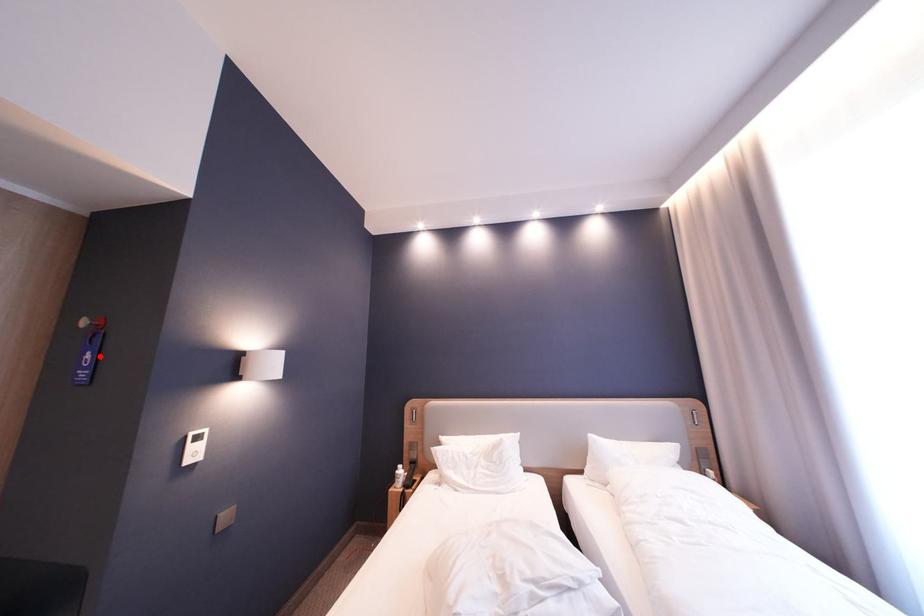
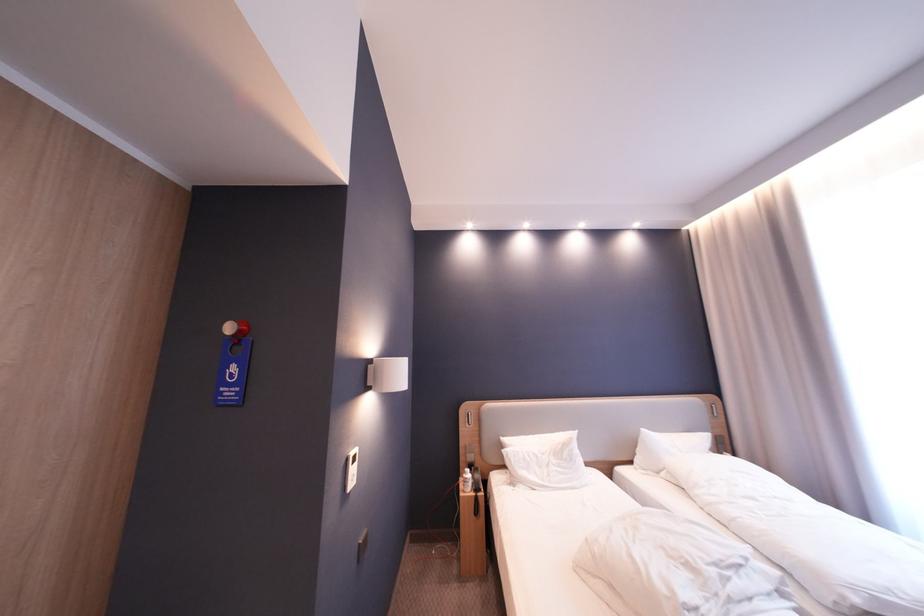
Find the pixel in the second image that matches the highlighted location in the first image.

(245, 370)